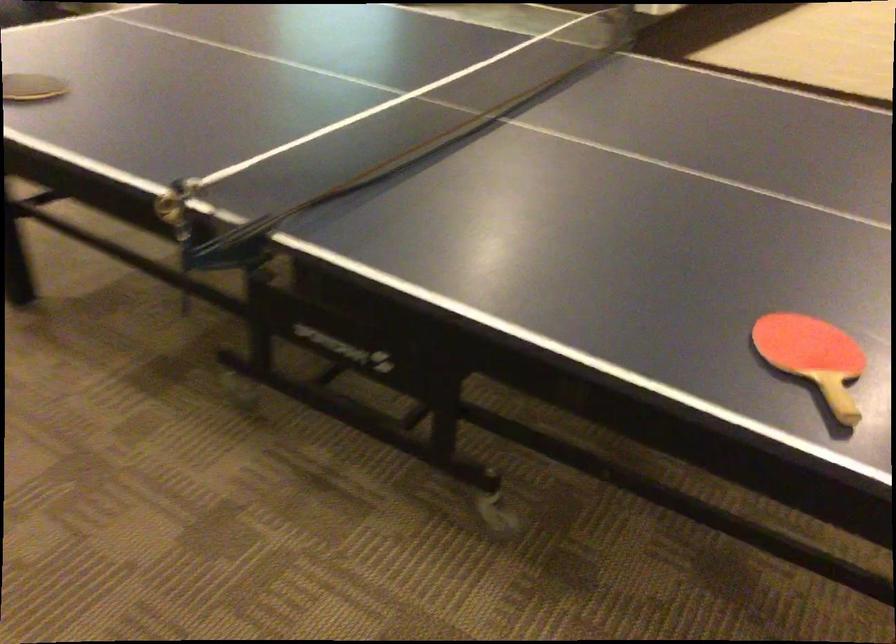
This screenshot has height=644, width=896. I want to click on net clamp screw, so click(x=174, y=207).